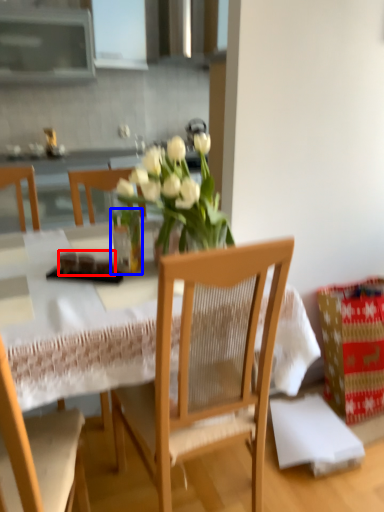
Question: Which object is further to the camera taking this photo, food (highlighted by a red box) or glass vase (highlighted by a blue box)?

Choices:
 (A) food
 (B) glass vase

Answer: (A)